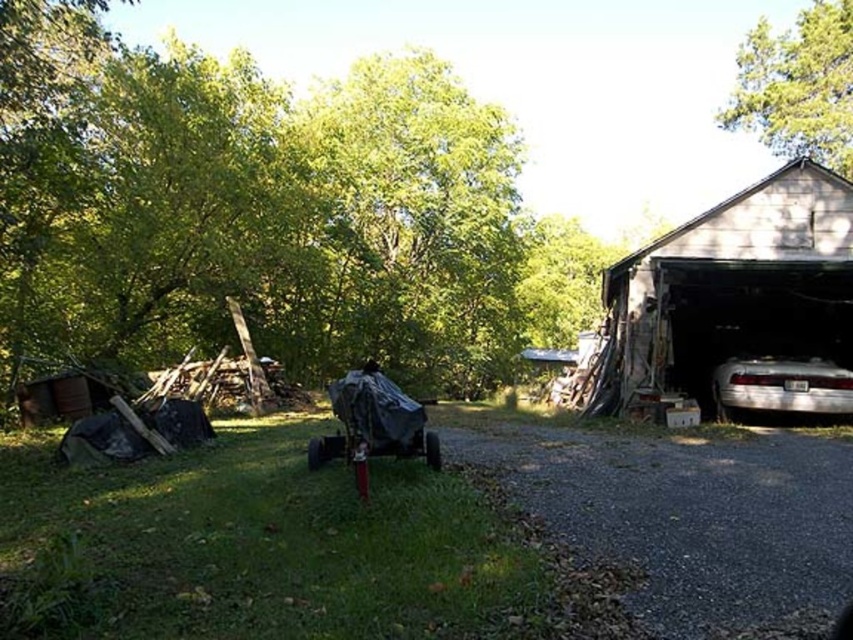
Question: Which point is farther to the camera?

Choices:
 (A) white glossy car at right
 (B) green leafy tree at upper left

Answer: (A)

Question: Is green leafy tree at upper left positioned behind green leafy tree at upper right?

Choices:
 (A) yes
 (B) no

Answer: (B)

Question: Which object is the farthest from the green leafy tree at upper right?

Choices:
 (A) silver metallic car at lower right
 (B) white glossy car at right
 (C) white wood barn at right
 (D) green leafy tree at upper left

Answer: (A)

Question: Can you confirm if white glossy car at right is positioned above green leafy tree at upper right?

Choices:
 (A) yes
 (B) no

Answer: (B)

Question: Estimate the real-world distances between objects in this image. Which object is closer to the green leafy tree at upper right?

Choices:
 (A) white glossy car at right
 (B) gray gravel driveway at lower right

Answer: (A)

Question: Does green leafy tree at upper left appear over white glossy car at right?

Choices:
 (A) no
 (B) yes

Answer: (B)